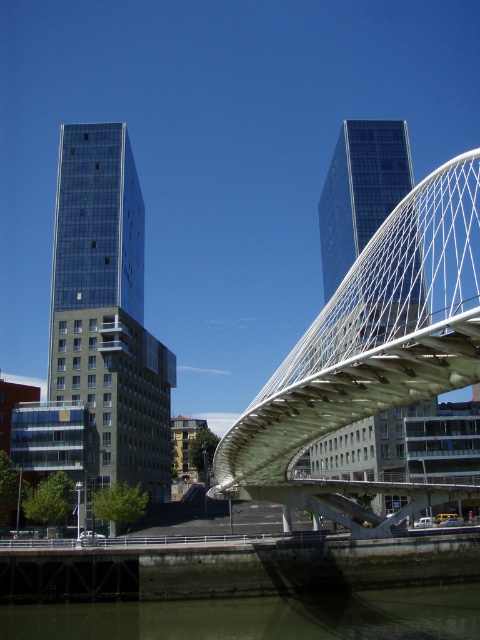
Locate an element on the screen. greenish water at lower center is located at coordinates (260, 616).

Does greenish water at lower center appear over glassy blue skyscraper at center?

No.

What do you see at coordinates (260, 616) in the screenshot?
I see `greenish water at lower center` at bounding box center [260, 616].

Locate an element on the screen. greenish water at lower center is located at coordinates (260, 616).

Is glassy blue building at center bigger than glassy blue skyscraper at center?

Incorrect, glassy blue building at center is not larger than glassy blue skyscraper at center.

Who is more forward, (56, 227) or (405, 188)?

Point (56, 227) is more forward.

Where is `glassy blue building at center`? Image resolution: width=480 pixels, height=640 pixels. glassy blue building at center is located at coordinates (108, 310).

Which of these two, glassy blue building at center or greenish water at lower center, stands taller?

glassy blue building at center is taller.

Is point (63, 148) positioned before point (347, 621)?

No, it is behind (347, 621).

Where is `glassy blue building at center`? The height and width of the screenshot is (640, 480). glassy blue building at center is located at coordinates (108, 310).